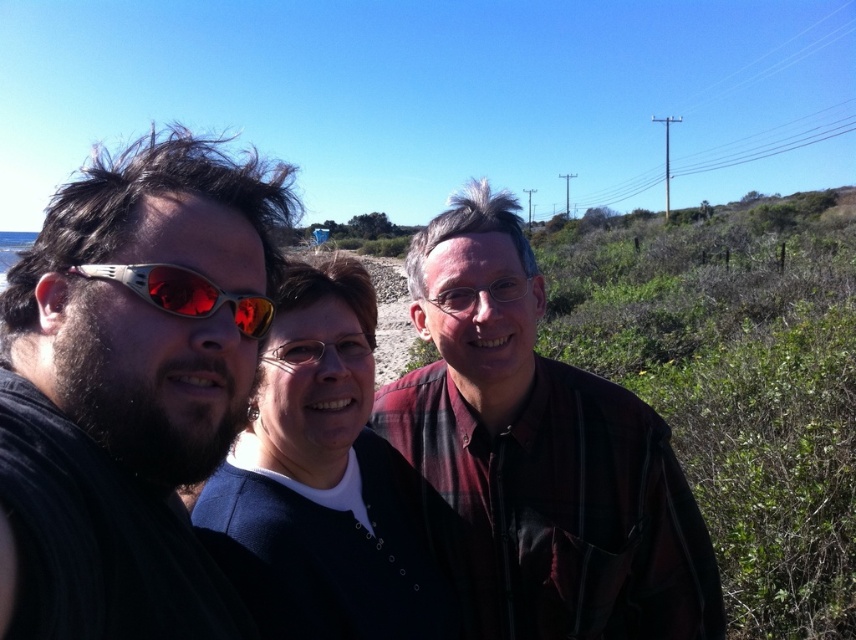
Between plaid shirt at center and dark blue sweater at center, which one is positioned higher?

Positioned higher is plaid shirt at center.

Is the position of plaid shirt at center more distant than that of dark blue sweater at center?

Yes, it is.

Is point (601, 397) more distant than point (312, 440)?

That is True.

Locate an element on the screen. plaid shirt at center is located at coordinates (539, 452).

Is point (526, 500) farther from viewer compared to point (645, 477)?

Yes.

Consider the image. Who is more distant from viewer, (638,522) or (675,554)?

The point (675,554) is more distant.

Which is in front, point (542, 625) or point (492, 220)?

Point (492, 220)

At what (x,y) coordinates should I click in order to perform the action: click on black fabric at center. Please return your answer as a coordinate pair (x, y). Looking at the image, I should click on (539, 456).

Does point (173, 214) come farther from viewer compared to point (134, 284)?

Yes, it is.

Looking at this image, between matte black shirt at left and matte plastic goggles at left, which one appears on the left side from the viewer's perspective?

Positioned to the left is matte black shirt at left.

Between point (144, 536) and point (230, 305), which one is positioned in front?

Point (144, 536) is in front.

Where is `matte black shirt at left`? This screenshot has height=640, width=856. matte black shirt at left is located at coordinates (129, 387).